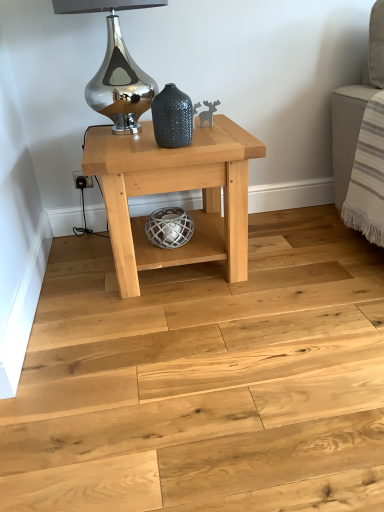
Identify the location of free location in front of textured dark gray vase at center. (170, 153).